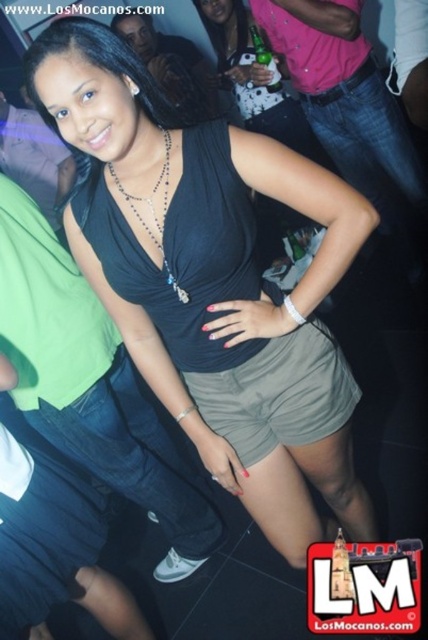
Question: Which point is closer to the camera taking this photo?

Choices:
 (A) (241, 216)
 (B) (165, 204)

Answer: (B)

Question: Does black matte tank top at center have a smaller size compared to silver beaded necklace at center?

Choices:
 (A) yes
 (B) no

Answer: (B)

Question: Does black matte tank top at center lie in front of silver beaded necklace at center?

Choices:
 (A) no
 (B) yes

Answer: (B)

Question: Which point is closer to the camera taking this photo?

Choices:
 (A) (53, 65)
 (B) (165, 186)

Answer: (A)

Question: Does black matte tank top at center have a larger size compared to silver beaded necklace at center?

Choices:
 (A) yes
 (B) no

Answer: (A)